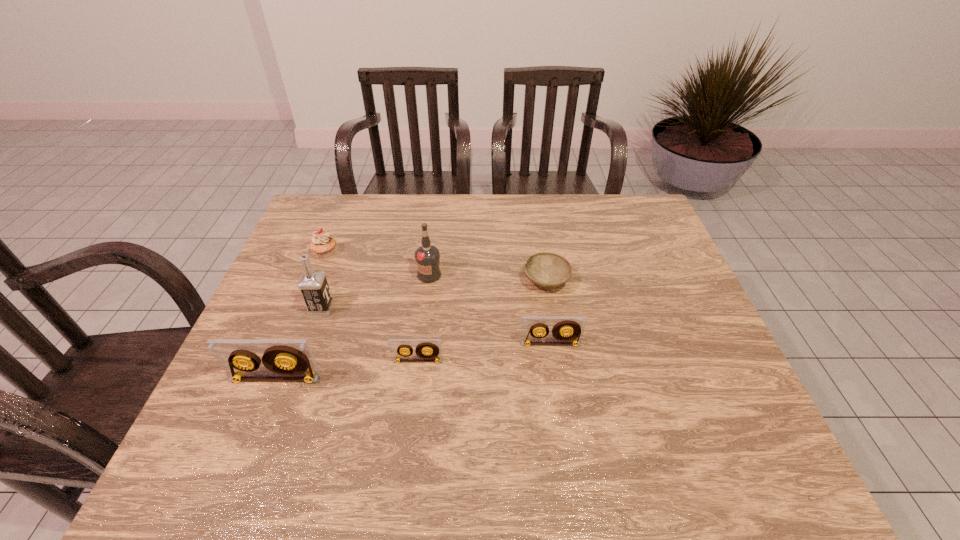
Identify the location of free space between the cupcake and the right vodka. The image size is (960, 540). (377, 264).

Locate an element on the screen. The height and width of the screenshot is (540, 960). blank region between the tallest videotape and the shortest object is located at coordinates (411, 330).

This screenshot has height=540, width=960. Identify the location of free space between the farthest object and the second videotape from right to left. [x=372, y=307].

Identify the location of vacant space that is in between the second shortest object and the farther vodka. (423, 318).

The height and width of the screenshot is (540, 960). Identify the location of blank region between the right vodka and the bowl. (488, 278).

Select which object appears as the fourth closest to the third tallest object. Please provide its 2D coordinates. Your answer should be formatted as a tuple, i.e. [(x, y)], where the tuple contains the x and y coordinates of a point satisfying the conditions above.

[(322, 244)]

You are a GUI agent. You are given a task and a screenshot of the screen. Output one action in this format:
    pyautogui.click(x=<x>, y=<y>)
    Task: Click on the object identified as the second closest to the left vodka
    The width and height of the screenshot is (960, 540).
    Given the screenshot: What is the action you would take?
    pyautogui.click(x=283, y=359)

Identify which videotape is located as the third nearest to the shortest object. Please provide its 2D coordinates. Your answer should be formatted as a tuple, i.e. [(x, y)], where the tuple contains the x and y coordinates of a point satisfying the conditions above.

[(283, 359)]

Identify the location of videotape that stands as the second closest to the shortest object. The image size is (960, 540). (425, 349).

At what (x,y) coordinates should I click in order to perform the action: click on free space that satisfies the following two spatial constraints: 1. on the front label of the farther vodka; 2. on the front label of the left vodka. Please return your answer as a coordinate pair (x, y). This screenshot has width=960, height=540. Looking at the image, I should click on coord(425,308).